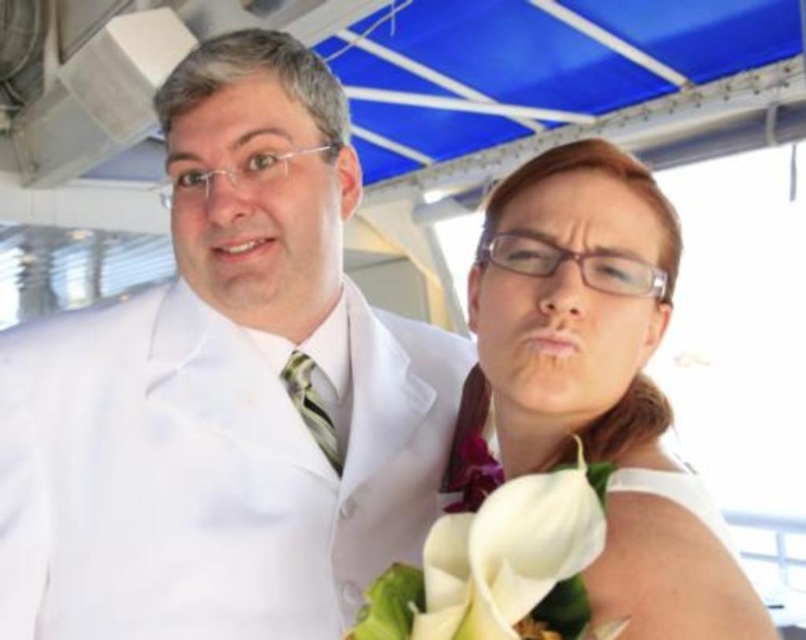
Is white matte suit at center positioned in front of white matte calla lilies at center?

No, it is not.

Does point (9, 365) come behind point (495, 531)?

Yes.

The width and height of the screenshot is (806, 640). Describe the element at coordinates (225, 392) in the screenshot. I see `white matte suit at center` at that location.

Locate an element on the screen. This screenshot has width=806, height=640. white matte suit at center is located at coordinates pos(225,392).

Is white satin dress at center closer to camera compared to white matte calla lilies at center?

No.

Is white satin dress at center smaller than white matte calla lilies at center?

No.

The image size is (806, 640). In order to click on white satin dress at center in this screenshot , I will do `click(593, 385)`.

Does white matte suit at center lie behind white satin dress at center?

Yes, it is.

Between point (123, 500) and point (603, 195), which one is positioned behind?

Point (123, 500)

You are a GUI agent. You are given a task and a screenshot of the screen. Output one action in this format:
    pyautogui.click(x=<x>, y=<y>)
    Task: Click on the white matte suit at center
    The height and width of the screenshot is (640, 806).
    Given the screenshot: What is the action you would take?
    pyautogui.click(x=225, y=392)